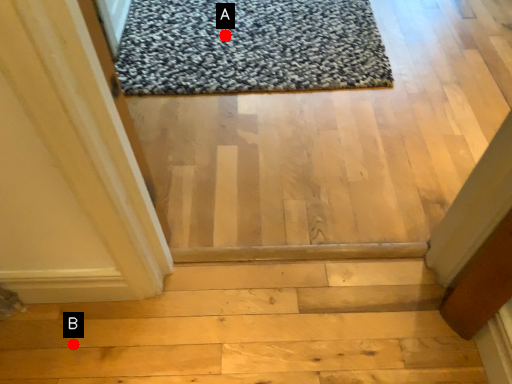
Question: Two points are circled on the image, labeled by A and B beside each circle. Which of the following is the closest to the observer?

Choices:
 (A) A is closer
 (B) B is closer

Answer: (B)